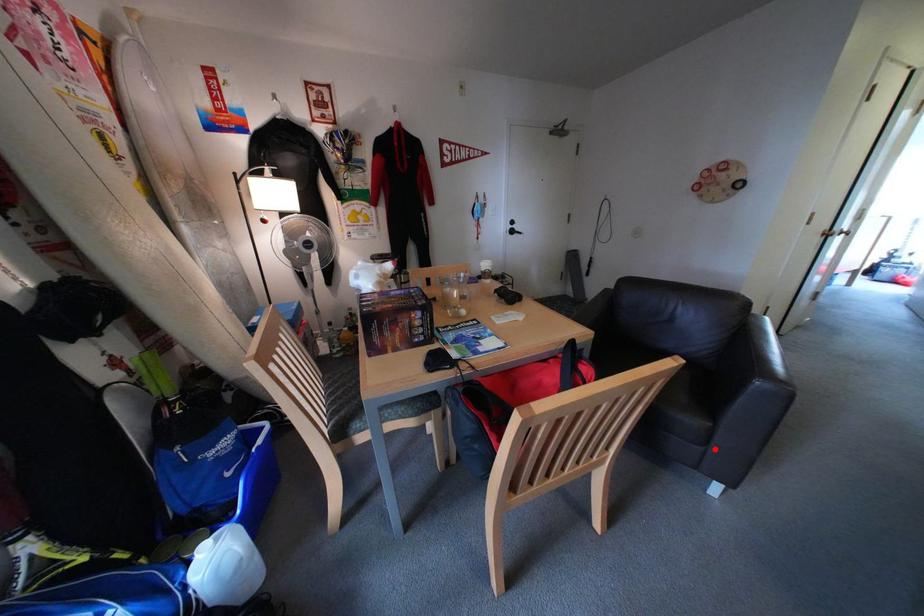
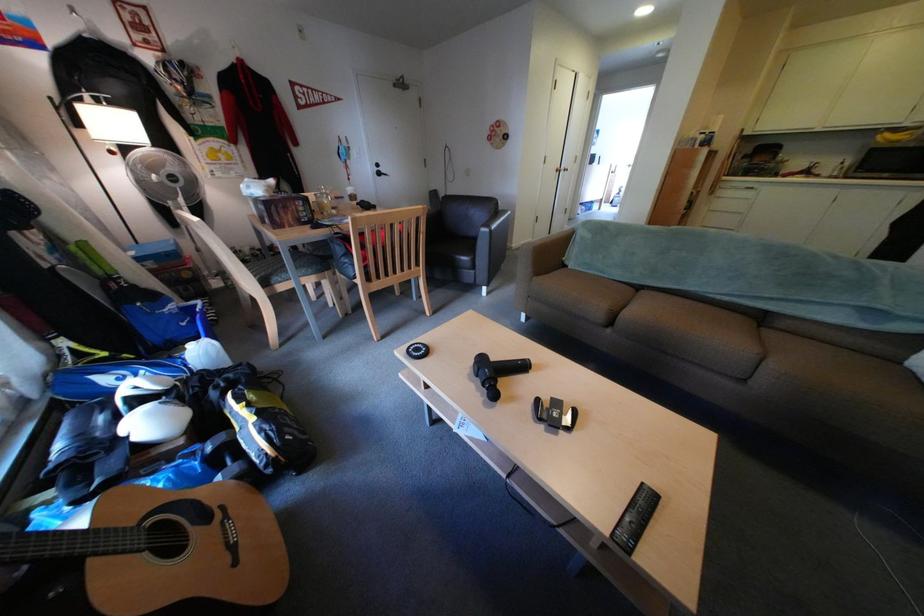
In the second image, find the point that corresponds to the highlighted location in the first image.

(487, 273)